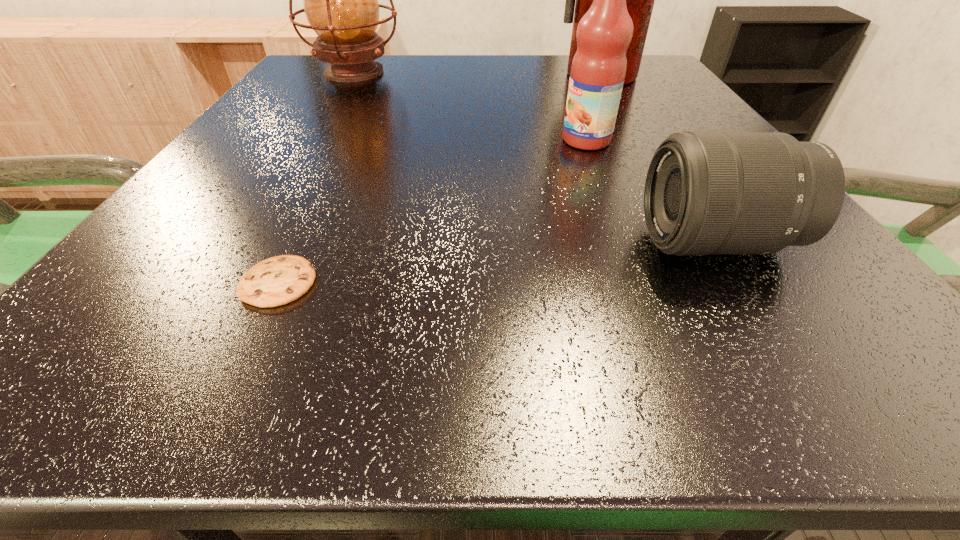
Image resolution: width=960 pixels, height=540 pixels. Find the location of `empty space between the shortest object and the fire extinguisher`. empty space between the shortest object and the fire extinguisher is located at coordinates (440, 179).

Identify the location of empty location between the cookie and the third farthest object. The width and height of the screenshot is (960, 540). (432, 211).

Find the location of a particular element. empty space that is in between the fire extinguisher and the shortest object is located at coordinates (440, 179).

I want to click on object that stands as the closest to the fruit juice, so click(706, 192).

Find the location of a particular element. object that can be found as the second closest to the second tallest object is located at coordinates (598, 69).

This screenshot has width=960, height=540. I want to click on vacant space that satisfies the following two spatial constraints: 1. on the side of the fire extinguisher with the handle and hose; 2. on the front label of the fruit juice, so click(x=637, y=140).